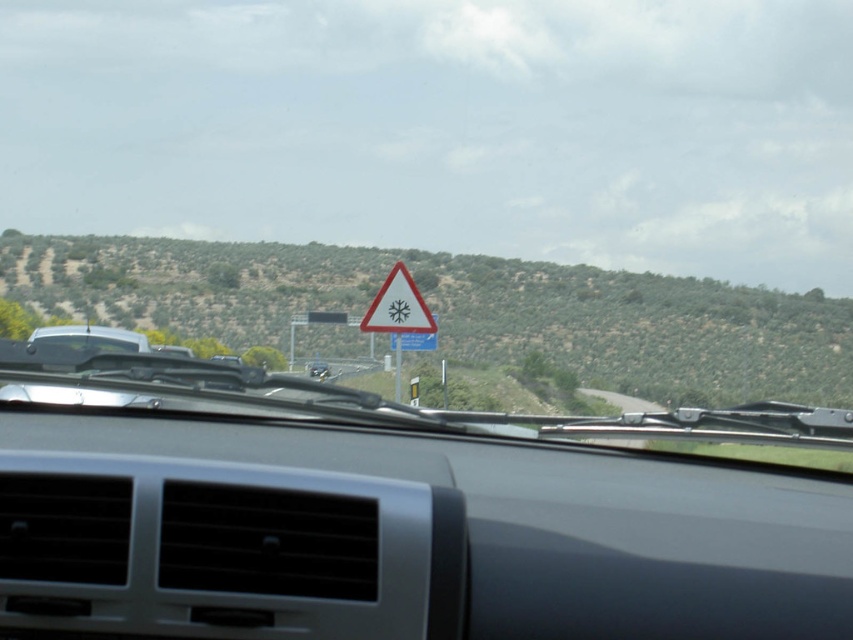
Question: Can you confirm if white triangular warning sign at center is smaller than matte black car at center?

Choices:
 (A) no
 (B) yes

Answer: (B)

Question: From the image, what is the correct spatial relationship of metallic dashboard at center in relation to white triangular warning sign at center?

Choices:
 (A) left
 (B) right

Answer: (B)

Question: Is the position of white triangular warning sign at center less distant than that of matte black car at center?

Choices:
 (A) yes
 (B) no

Answer: (A)

Question: Which of these objects is positioned closest to the metallic dashboard at center?

Choices:
 (A) white triangular warning sign at center
 (B) matte black car at center

Answer: (A)

Question: Which object is farther from the camera taking this photo?

Choices:
 (A) matte black car at center
 (B) white triangular warning sign at center
 (C) metallic dashboard at center

Answer: (A)

Question: Which object appears closest to the camera in this image?

Choices:
 (A) white triangular warning sign at center
 (B) matte black car at center

Answer: (A)